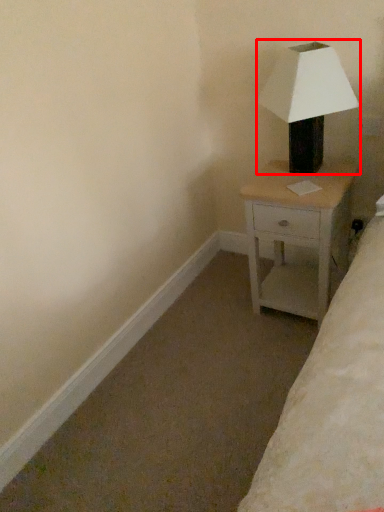
Question: From the image's perspective, considering the relative positions of lamp (annotated by the red box) and nightstand in the image provided, where is lamp (annotated by the red box) located with respect to the staircase?

Choices:
 (A) below
 (B) above

Answer: (B)